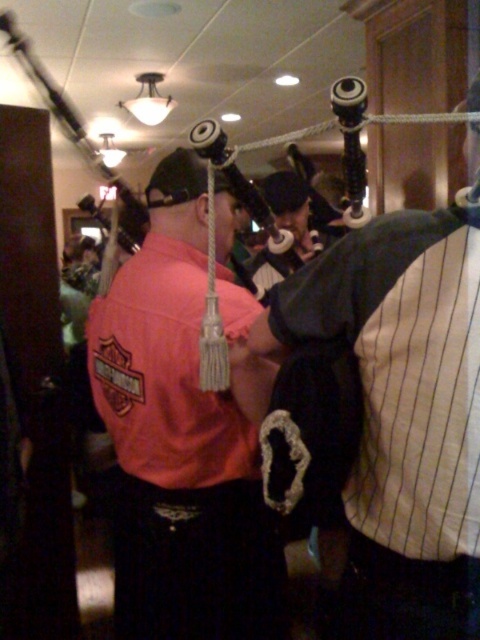
What is the object located at the coordinates point [181,440] in the image?

The object located at point [181,440] is the pink fabric shirt at center.

In the scene shown: You are a photographer at the event and want to capture a photo of the pink fabric shirt at center and the black matte bagpipes at center. Which object should you focus on first if you want to ensure both are in focus?

The pink fabric shirt at center is much taller than the black matte bagpipes at center, so focusing on the shirt first would help ensure both are in focus since it is the larger object in the frame.